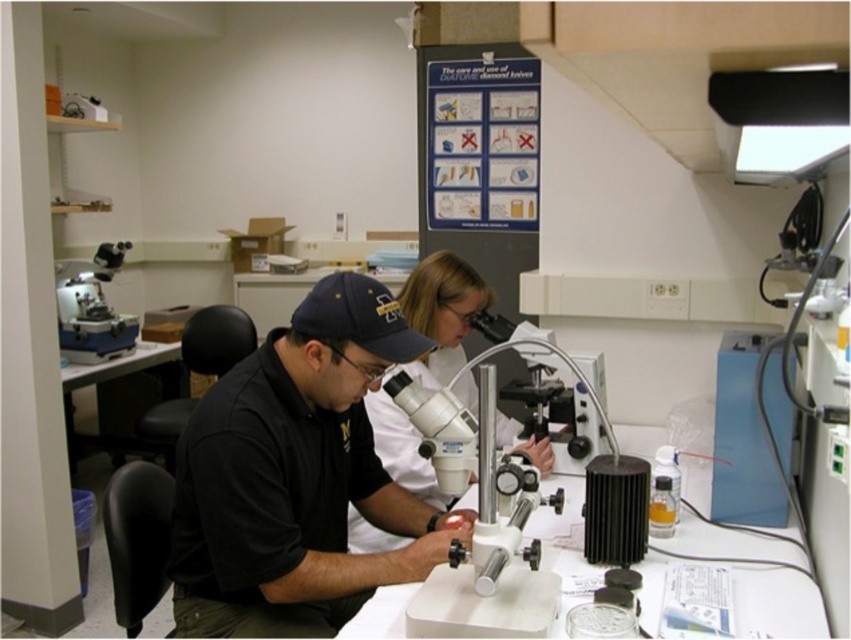
You are an observer looking at the laboratory scene. You notice the matte white lab coat at center and the matte white microscope at upper left. Which object is located higher in the image?

The matte white microscope at upper left is higher in the image than the matte white lab coat at center because the lab coat is positioned under the microscope.

You are a new intern in the lab and need to identify which equipment is smaller between the white plastic microscope at center and the matte white lab coat at center. Which one is smaller?

The white plastic microscope at center has a smaller size compared to the matte white lab coat at center, so the white plastic microscope at center is smaller.